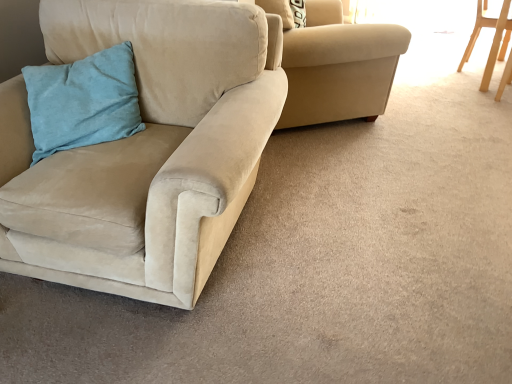
Question: Is suede beige armchair at upper center, the 2th chair when ordered from right to left, in front of or behind teal suede pillow at left in the image?

Choices:
 (A) front
 (B) behind

Answer: (B)

Question: From the image's perspective, is suede beige armchair at upper center, placed as the 2th chair when sorted from left to right, above or below teal suede pillow at left?

Choices:
 (A) below
 (B) above

Answer: (B)

Question: Which is farther from the suede beige armchair at upper center, placed as the 2th chair when sorted from left to right?

Choices:
 (A) light wood chair at upper right, which appears as the 3th chair when viewed from the left
 (B) teal suede pillow at left
 (C) suede beige couch at left, which appears as the 3th chair when viewed from the right

Answer: (A)

Question: Which of these objects is positioned closest to the suede beige armchair at upper center, the 2th chair when ordered from right to left?

Choices:
 (A) suede beige couch at left, the 1th chair viewed from the left
 (B) light wood chair at upper right, which appears as the 3th chair when viewed from the left
 (C) teal suede pillow at left

Answer: (A)